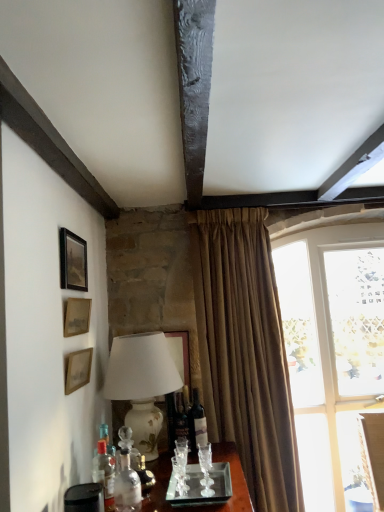
Question: Relative to matte gold picture frame at upper left, placed as the second picture frame when sorted from bottom to top, is translucent glass wine bottle at center, the 3th bottle from the left, in front or behind?

Choices:
 (A) behind
 (B) front

Answer: (A)

Question: Considering the positions of translucent glass wine bottle at center, the 3th bottle from the left, and matte gold picture frame at upper left, the 2th picture frame positioned from the top, in the image, is translucent glass wine bottle at center, the 3th bottle from the left, taller or shorter than matte gold picture frame at upper left, the 2th picture frame positioned from the top,?

Choices:
 (A) short
 (B) tall

Answer: (B)

Question: Which of these objects is positioned closest to the matte glass wine bottle at center?

Choices:
 (A) translucent glass wine bottle at center, the third bottle in the front-to-back sequence
 (B) clear glass bottle at lower left, which appears as the second bottle when viewed from the back
 (C) white ceramic lamp at left
 (D) matte gold picture frame at upper left, the 2th picture frame positioned from the top
 (E) beige textured curtain at center

Answer: (A)

Question: Which object is the farthest from the clear glass window at right?

Choices:
 (A) clear glass bottle at lower left, which appears as the 3th bottle when viewed from the right
 (B) wooden picture frame at left, the third picture frame from the top
 (C) matte black picture frame at upper left, the 3th picture frame positioned from the bottom
 (D) matte glass wine bottle at center
 (E) beige textured curtain at center

Answer: (A)